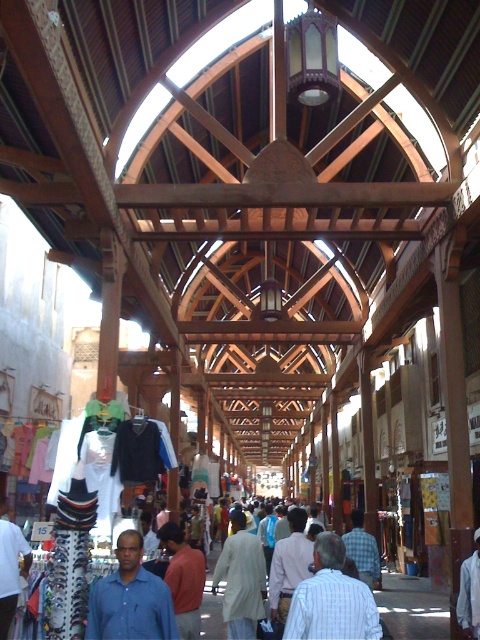
Can you confirm if light blue shirt at center is wider than white fabric shirt at center?

Yes, light blue shirt at center is wider than white fabric shirt at center.

Between point (371, 616) and point (467, 573), which one is positioned in front?

Point (371, 616) is in front.

Is point (322, 547) positioned after point (467, 572)?

No.

Identify the location of light blue shirt at center. Image resolution: width=480 pixels, height=640 pixels. (332, 598).

Between blue shirt at center and light beige fabric at center, which one has more height?

With more height is light beige fabric at center.

Is blue shirt at center shorter than light beige fabric at center?

Yes, blue shirt at center is shorter than light beige fabric at center.

Describe the element at coordinates (130, 598) in the screenshot. I see `blue shirt at center` at that location.

Identify the location of blue shirt at center. The image size is (480, 640). (130, 598).

Can you confirm if light blue shirt at center is thinner than blue shirt at center?

No, light blue shirt at center is not thinner than blue shirt at center.

Where is `light blue shirt at center`? light blue shirt at center is located at coordinates (332, 598).

Which is in front, point (321, 557) or point (156, 580)?

Positioned in front is point (156, 580).

Locate an element on the screen. Image resolution: width=480 pixels, height=640 pixels. light blue shirt at center is located at coordinates (332, 598).